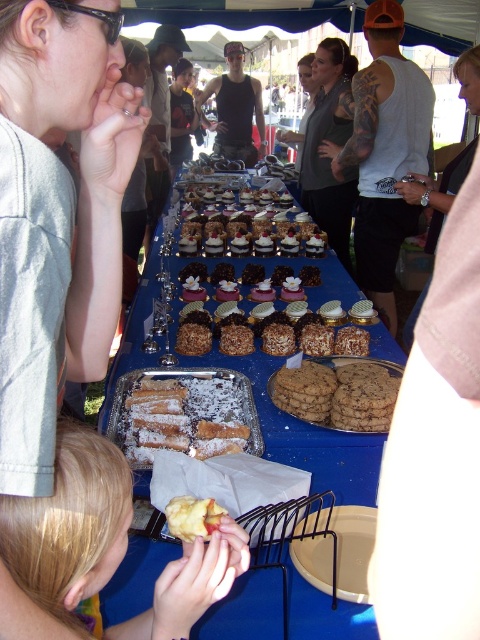
Question: Estimate the real-world distances between objects in this image. Which object is farther from the yellow matte apple at lower center?

Choices:
 (A) matte gray shirt at upper left
 (B) smooth chocolate cake at center
 (C) chocolate chip cookie at center
 (D) white plastic bucket at lower center

Answer: (B)

Question: Estimate the real-world distances between objects in this image. Which object is farther from the smooth yellow cake at lower left?

Choices:
 (A) smooth chocolate cake at center
 (B) chocolate chip cookie at center
 (C) white plastic bucket at lower center
 (D) gray fabric shirt at center

Answer: (D)

Question: Among these objects, which one is nearest to the camera?

Choices:
 (A) smooth chocolate cake at center
 (B) matte gray shirt at upper left

Answer: (B)

Question: Can you confirm if matte black shirt at center is positioned to the right of yellow matte apple at lower center?

Choices:
 (A) yes
 (B) no

Answer: (B)

Question: Is chocolate chip cookie at center further to the viewer compared to yellow matte apple at lower center?

Choices:
 (A) no
 (B) yes

Answer: (B)

Question: Is white plastic bucket at lower center in front of yellow matte apple at lower center?

Choices:
 (A) no
 (B) yes

Answer: (A)